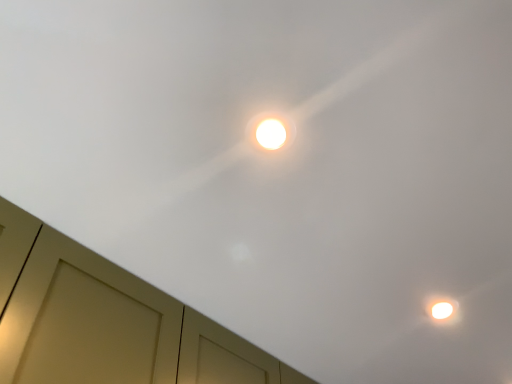
Question: Does white glossy droplight at center appear on the right side of matte wood dresser at lower left?

Choices:
 (A) yes
 (B) no

Answer: (A)

Question: From a real-world perspective, is white glossy droplight at center on top of matte wood dresser at lower left?

Choices:
 (A) no
 (B) yes

Answer: (B)

Question: Is white glossy droplight at center positioned behind matte wood dresser at lower left?

Choices:
 (A) yes
 (B) no

Answer: (A)

Question: Is white glossy droplight at center wider than matte wood dresser at lower left?

Choices:
 (A) no
 (B) yes

Answer: (A)

Question: Is matte wood dresser at lower left at the back of white glossy droplight at center?

Choices:
 (A) yes
 (B) no

Answer: (A)

Question: Is matte wood dresser at lower left inside white glossy droplight at center?

Choices:
 (A) no
 (B) yes

Answer: (A)

Question: Is matte wood dresser at lower left in contact with white glossy droplight at center?

Choices:
 (A) yes
 (B) no

Answer: (B)

Question: Considering the relative positions of matte wood dresser at lower left and white glossy droplight at center in the image provided, is matte wood dresser at lower left to the right of white glossy droplight at center from the viewer's perspective?

Choices:
 (A) yes
 (B) no

Answer: (B)

Question: Is matte wood dresser at lower left not inside white glossy droplight at center?

Choices:
 (A) yes
 (B) no

Answer: (A)

Question: From a real-world perspective, does matte wood dresser at lower left stand above white glossy droplight at center?

Choices:
 (A) no
 (B) yes

Answer: (A)

Question: Is matte wood dresser at lower left not near white glossy droplight at center?

Choices:
 (A) yes
 (B) no

Answer: (B)

Question: Is the position of matte wood dresser at lower left more distant than that of white glossy droplight at center?

Choices:
 (A) no
 (B) yes

Answer: (A)

Question: Does point (250, 130) appear closer or farther from the camera than point (54, 375)?

Choices:
 (A) closer
 (B) farther

Answer: (A)